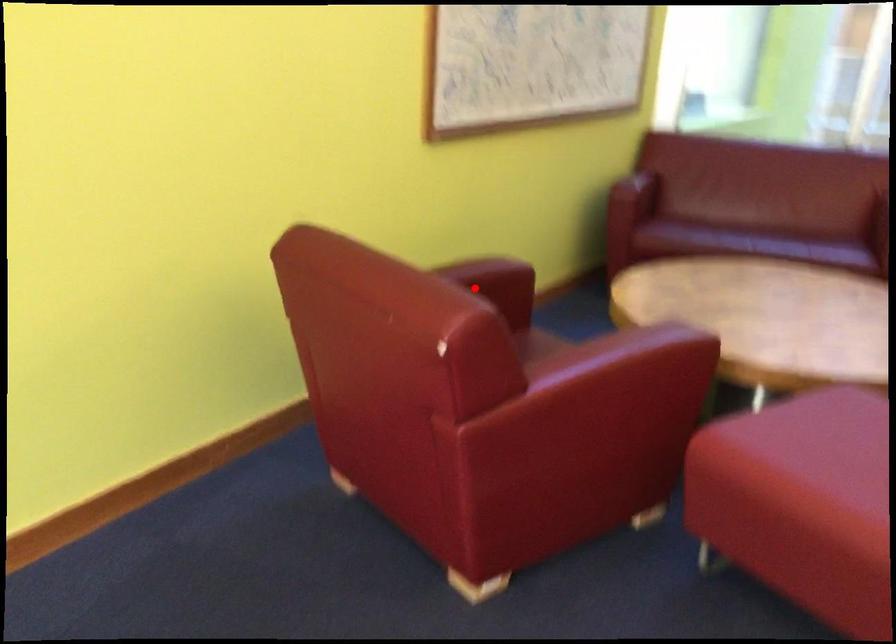
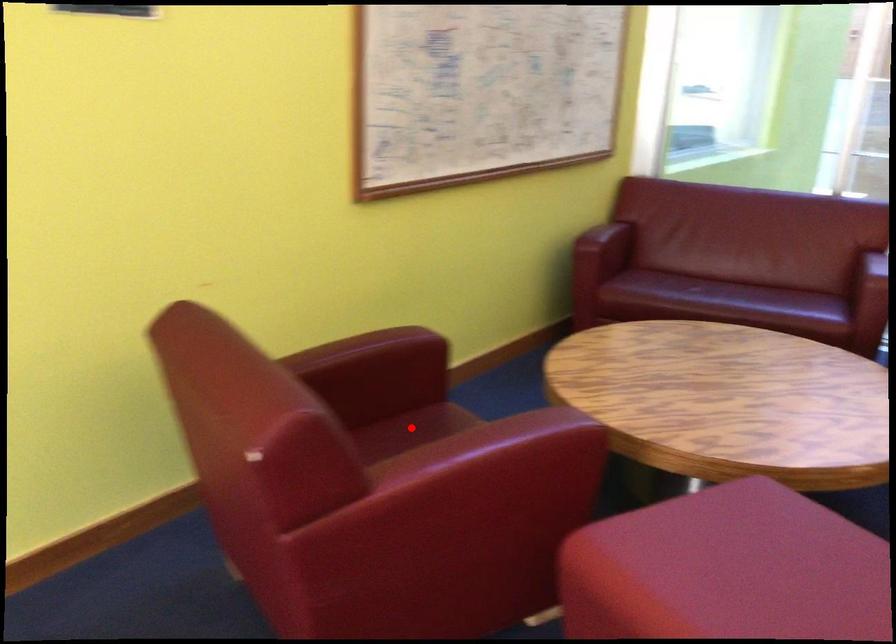
I am providing you with two images of the same scene from different viewpoints. A red point is marked on the first image and another point is marked on the second image. Do the highlighted points in image1 and image2 indicate the same real-world spot?

No